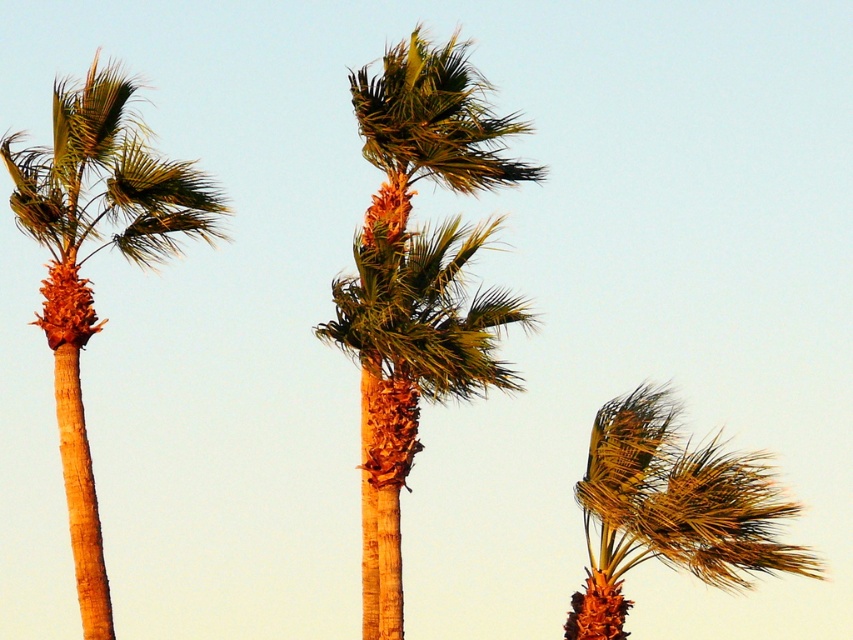
Question: Which point is closer to the camera?

Choices:
 (A) golden textured palm tree at center
 (B) green leafy palm tree at left
 (C) green leafy palm tree at center

Answer: (C)

Question: Where is green leafy palm tree at left located in relation to golden textured palm tree at center in the image?

Choices:
 (A) above
 (B) below

Answer: (A)

Question: Which of these objects is positioned farthest from the green leafy palm tree at center?

Choices:
 (A) green leafy palm tree at left
 (B) golden textured palm tree at center

Answer: (A)

Question: Which point is farther to the camera?

Choices:
 (A) green leafy palm tree at center
 (B) green leafy palm tree at left

Answer: (B)

Question: Is green leafy palm tree at center above green leafy palm tree at left?

Choices:
 (A) yes
 (B) no

Answer: (A)

Question: In this image, where is green leafy palm tree at left located relative to golden textured palm tree at center?

Choices:
 (A) above
 (B) below

Answer: (A)